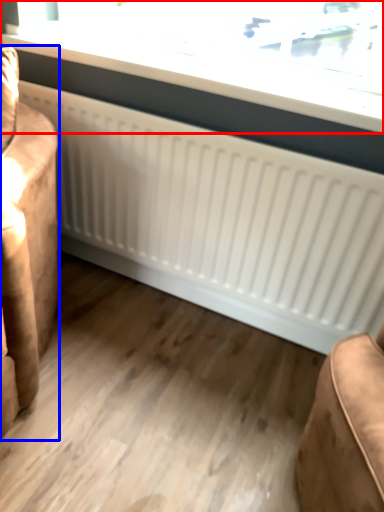
Question: Which point is closer to the camera, window (highlighted by a red box) or furniture (highlighted by a blue box)?

Choices:
 (A) window
 (B) furniture

Answer: (B)